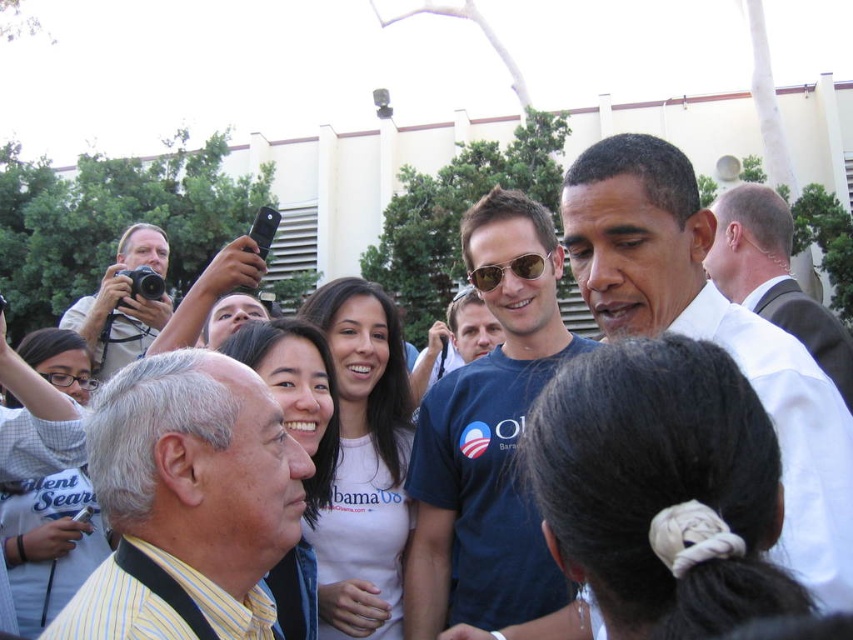
You are a photographer at the event and want to take a photo of the central figure without any obstructions. You have a matte black camera at upper left and notice a white shirt at upper right. Which object should you avoid moving so it doesn not block your view?

You should avoid moving the white shirt at upper right because it is in front of the matte black camera at upper left and could obstruct the view.

You are a photographer at the event and need to capture a photo that includes both the white shirt at upper right and the matte black camera at upper left. Given that your camera has a maximum focal length of 50 meters, will you be able to frame both objects in a single shot?

The white shirt at upper right and matte black camera at upper left are 25.88 meters apart. Since your camera has a maximum focal length of 50 meters, which is greater than the distance between them, you can frame both objects in a single shot.